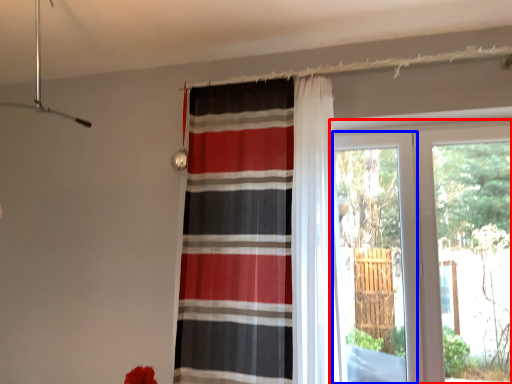
Question: Among these objects, which one is nearest to the camera, window (highlighted by a red box) or screen door (highlighted by a blue box)?

Choices:
 (A) window
 (B) screen door

Answer: (A)